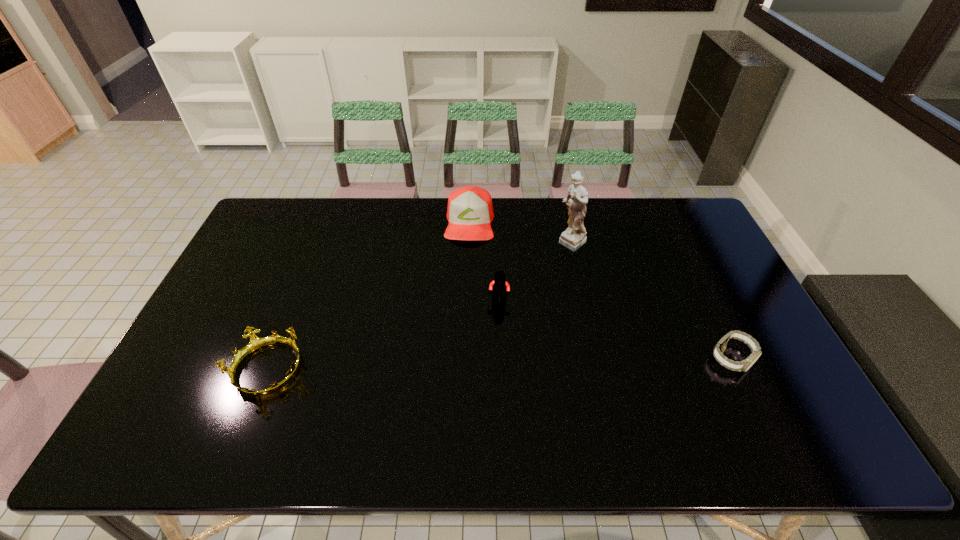
The height and width of the screenshot is (540, 960). In order to click on empty location between the second object from right to left and the third farthest object in this screenshot , I will do `click(536, 272)`.

Where is `empty location between the tallest object and the crown`? This screenshot has width=960, height=540. empty location between the tallest object and the crown is located at coordinates (420, 307).

I want to click on vacant area that lies between the tallest object and the Lego, so click(x=536, y=272).

What are the coordinates of `free space between the watch and the third farthest object` in the screenshot? It's located at (615, 329).

The width and height of the screenshot is (960, 540). Identify the location of empty space between the tallest object and the third nearest object. (536, 272).

The image size is (960, 540). Find the location of `free space between the watch and the baseball cap`. free space between the watch and the baseball cap is located at coordinates (600, 291).

At what (x,y) coordinates should I click in order to perform the action: click on free space between the third nearest object and the baseball cap. Please return your answer as a coordinate pair (x, y). Looking at the image, I should click on (484, 261).

The height and width of the screenshot is (540, 960). In order to click on the fourth closest object to the baseball cap in this screenshot , I will do `click(744, 365)`.

Choose which object is the nearest neighbor to the second object from right to left. Please provide its 2D coordinates. Your answer should be formatted as a tuple, i.e. [(x, y)], where the tuple contains the x and y coordinates of a point satisfying the conditions above.

[(470, 211)]

This screenshot has width=960, height=540. Identify the location of vacant space that satisfies the following two spatial constraints: 1. on the back side of the figurine; 2. on the right side of the third nearest object. (496, 244).